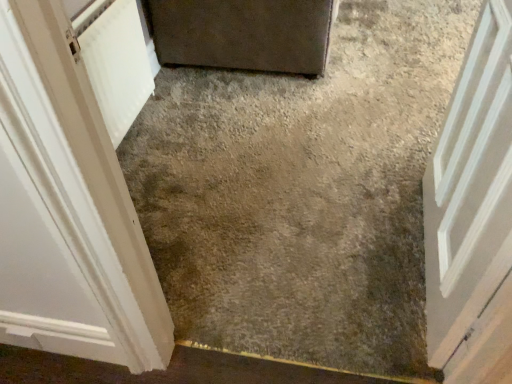
Question: Is matte gray door at upper center, which is the 2th door in left-to-right order, facing away from white painted wood door at left, the first door in the left-to-right sequence?

Choices:
 (A) yes
 (B) no

Answer: (B)

Question: Considering the relative positions of matte gray door at upper center, which is the 2th door in left-to-right order, and white painted wood door at left, the 3th door positioned from the right, in the image provided, is matte gray door at upper center, which is the 2th door in left-to-right order, to the right of white painted wood door at left, the 3th door positioned from the right, from the viewer's perspective?

Choices:
 (A) no
 (B) yes

Answer: (B)

Question: Is matte gray door at upper center, the 2th door positioned from the right, outside white painted wood door at left, the first door in the left-to-right sequence?

Choices:
 (A) yes
 (B) no

Answer: (A)

Question: Is matte gray door at upper center, which is the 2th door in left-to-right order, wider than white painted wood door at left, the 3th door positioned from the right?

Choices:
 (A) no
 (B) yes

Answer: (B)

Question: Is matte gray door at upper center, which is the 2th door in left-to-right order, facing towards white painted wood door at left, the 3th door positioned from the right?

Choices:
 (A) no
 (B) yes

Answer: (A)

Question: From a real-world perspective, is gray concrete at center above or below white painted wood door at left, the first door in the left-to-right sequence?

Choices:
 (A) above
 (B) below

Answer: (B)

Question: From the image's perspective, is gray concrete at center positioned above or below white painted wood door at left, the 3th door positioned from the right?

Choices:
 (A) above
 (B) below

Answer: (A)

Question: Is gray concrete at center situated inside white painted wood door at left, the first door in the left-to-right sequence, or outside?

Choices:
 (A) outside
 (B) inside

Answer: (A)

Question: Is gray concrete at center taller or shorter than white painted wood door at left, the first door in the left-to-right sequence?

Choices:
 (A) short
 (B) tall

Answer: (A)

Question: Is point (40, 241) closer or farther from the camera than point (352, 360)?

Choices:
 (A) closer
 (B) farther

Answer: (A)

Question: From the image's perspective, is white painted wood door at left, the 3th door positioned from the right, positioned above or below gray concrete at center?

Choices:
 (A) above
 (B) below

Answer: (B)

Question: From a real-world perspective, is white painted wood door at left, the first door in the left-to-right sequence, positioned above or below gray concrete at center?

Choices:
 (A) below
 (B) above

Answer: (B)

Question: Which is correct: white painted wood door at left, the 3th door positioned from the right, is inside gray concrete at center, or outside of it?

Choices:
 (A) inside
 (B) outside

Answer: (B)

Question: Which is correct: matte gray door at upper center, which is the 2th door in left-to-right order, is inside gray concrete at center, or outside of it?

Choices:
 (A) outside
 (B) inside

Answer: (A)

Question: Considering their positions, is matte gray door at upper center, which is the 2th door in left-to-right order, located in front of or behind gray concrete at center?

Choices:
 (A) behind
 (B) front

Answer: (A)